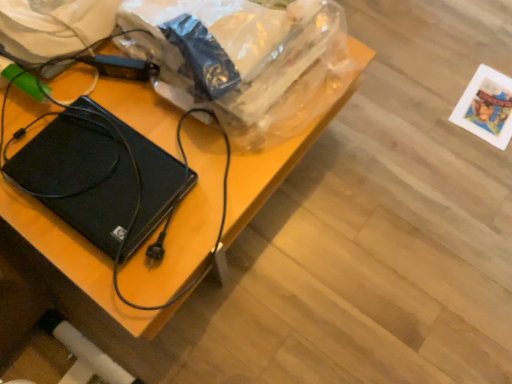
At what (x,y) coordinates should I click in order to perform the action: click on vacant space situated above black plastic hard drive at center (from a real-world perspective). Please return your answer as a coordinate pair (x, y). Image resolution: width=512 pixels, height=384 pixels. Looking at the image, I should click on (111, 131).